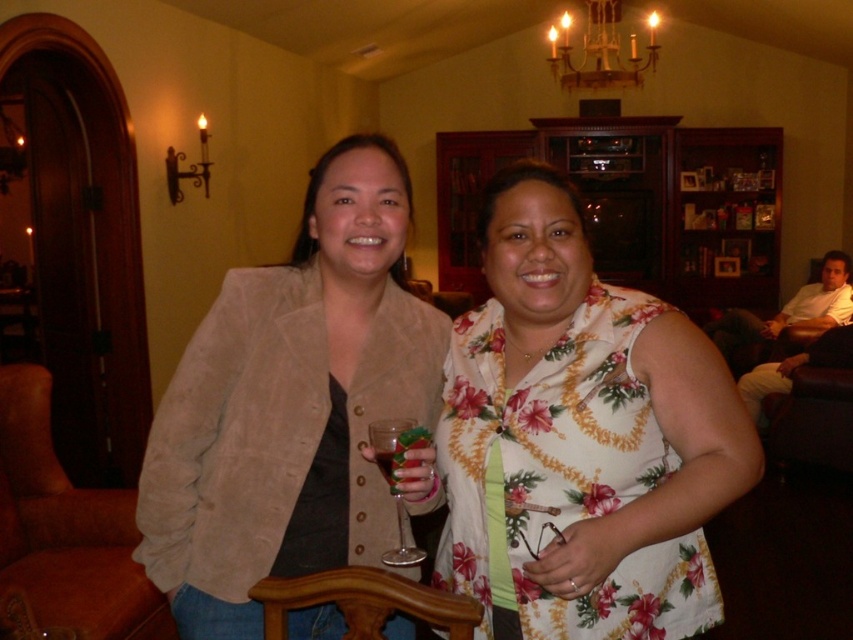
Can you confirm if floral print blouse at center is smaller than translucent glass at center?

No.

Which is behind, point (647, 440) or point (386, 465)?

Point (647, 440)

Which is in front, point (660, 480) or point (393, 438)?

Point (393, 438)

Locate an element on the screen. The width and height of the screenshot is (853, 640). floral print blouse at center is located at coordinates (579, 438).

Does suede jacket at center appear on the right side of brown wooden armchair at lower center?

Incorrect, suede jacket at center is not on the right side of brown wooden armchair at lower center.

Between point (281, 358) and point (352, 611), which one is positioned behind?

Positioned behind is point (281, 358).

This screenshot has height=640, width=853. What are the coordinates of `suede jacket at center` in the screenshot? It's located at (291, 404).

Image resolution: width=853 pixels, height=640 pixels. I want to click on floral print blouse at center, so click(x=579, y=438).

Who is taller, floral print blouse at center or suede jacket at center?

suede jacket at center

Image resolution: width=853 pixels, height=640 pixels. Describe the element at coordinates (579, 438) in the screenshot. I see `floral print blouse at center` at that location.

Where is `floral print blouse at center`? This screenshot has height=640, width=853. floral print blouse at center is located at coordinates (579, 438).